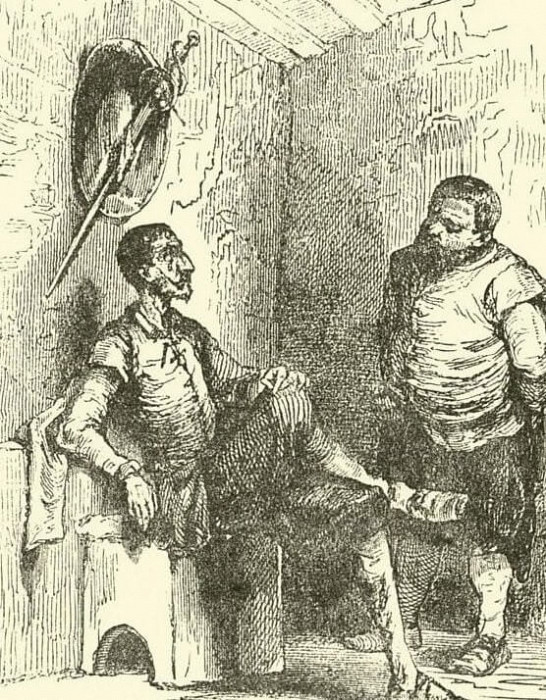
Find the location of a particular element. This screenshot has height=700, width=546. sword on a wall is located at coordinates (173, 101).